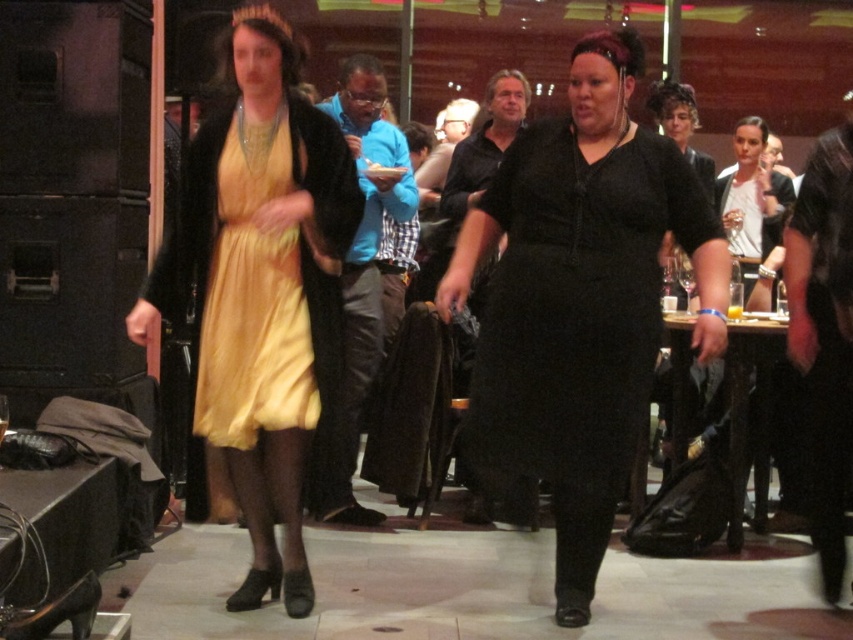
Question: Does black velvet dress at center lie behind yellow satin dress at center?

Choices:
 (A) no
 (B) yes

Answer: (A)

Question: Which object appears closest to the camera in this image?

Choices:
 (A) yellow satin dress at center
 (B) black velvet dress at center
 (C) satin yellow dress at center

Answer: (B)

Question: Is satin yellow dress at center smaller than yellow satin dress at center?

Choices:
 (A) no
 (B) yes

Answer: (A)

Question: Among these objects, which one is nearest to the camera?

Choices:
 (A) black velvet dress at center
 (B) satin yellow dress at center
 (C) yellow satin dress at center

Answer: (A)

Question: Among these objects, which one is farthest from the camera?

Choices:
 (A) black velvet dress at center
 (B) satin yellow dress at center

Answer: (B)

Question: Does black velvet dress at center have a greater width compared to satin yellow dress at center?

Choices:
 (A) yes
 (B) no

Answer: (A)